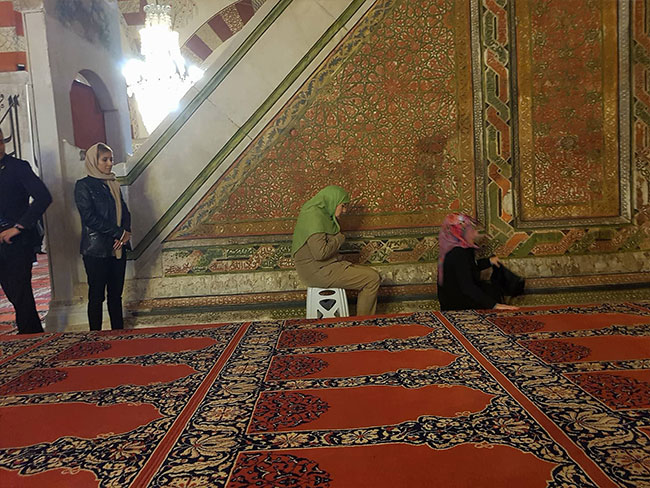
Locate an element on the screen. pink cover is located at coordinates (452, 224).